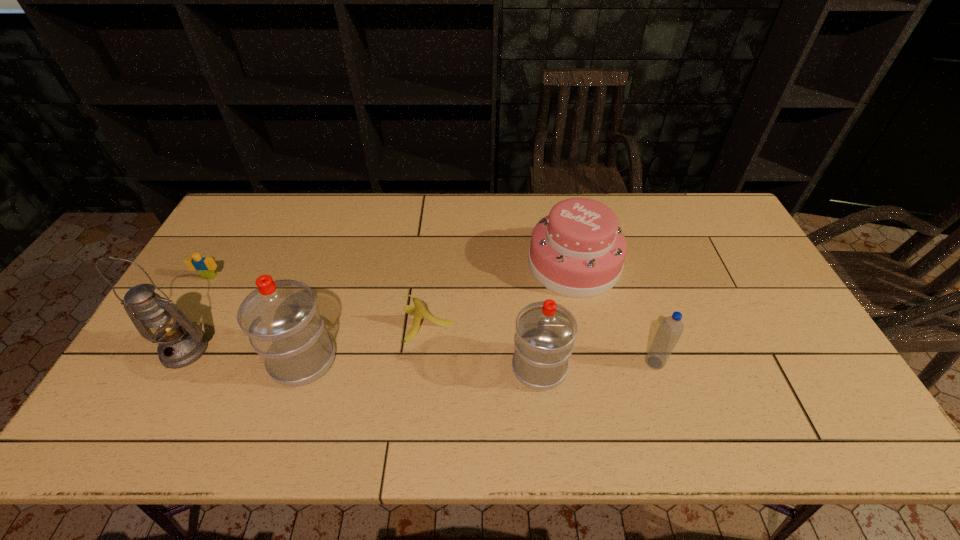
Where is `vacant area between the shortest water bottle and the oil lamp`? vacant area between the shortest water bottle and the oil lamp is located at coordinates (420, 356).

The image size is (960, 540). I want to click on free space between the oil lamp and the shortest water bottle, so click(x=420, y=356).

Where is `free point between the rightmost water bottle and the second shortest water bottle`? This screenshot has width=960, height=540. free point between the rightmost water bottle and the second shortest water bottle is located at coordinates (x=597, y=365).

Locate an element on the screen. vacant space that's between the third tallest object and the rightmost water bottle is located at coordinates (597, 365).

Locate an element on the screen. The width and height of the screenshot is (960, 540). vacant area that lies between the second shortest water bottle and the oil lamp is located at coordinates (362, 359).

This screenshot has height=540, width=960. Find the location of `blank region between the Lego and the cake`. blank region between the Lego and the cake is located at coordinates (392, 271).

Find the location of `free space that is in between the shortest water bottle and the cake`. free space that is in between the shortest water bottle and the cake is located at coordinates (614, 313).

Identify the location of vacant point located between the Lego and the second water bottle from right to left. (374, 322).

Where is `object identified as the third closest to the shortest water bottle`? Image resolution: width=960 pixels, height=540 pixels. object identified as the third closest to the shortest water bottle is located at coordinates (420, 311).

Locate an element on the screen. This screenshot has width=960, height=540. the third closest object to the banana is located at coordinates (578, 250).